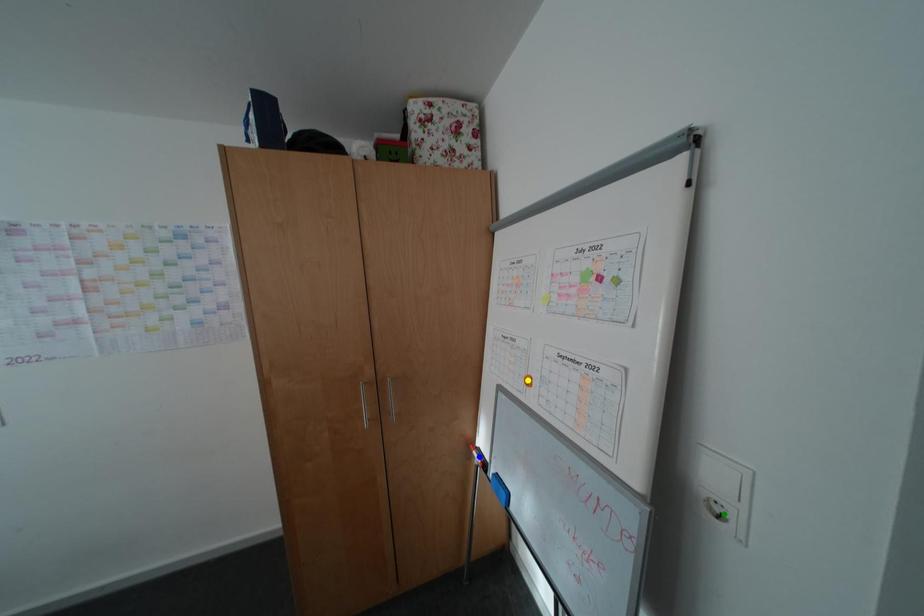
Order these from nearest to farthest:
yellow point, blue point, green point

blue point, yellow point, green point